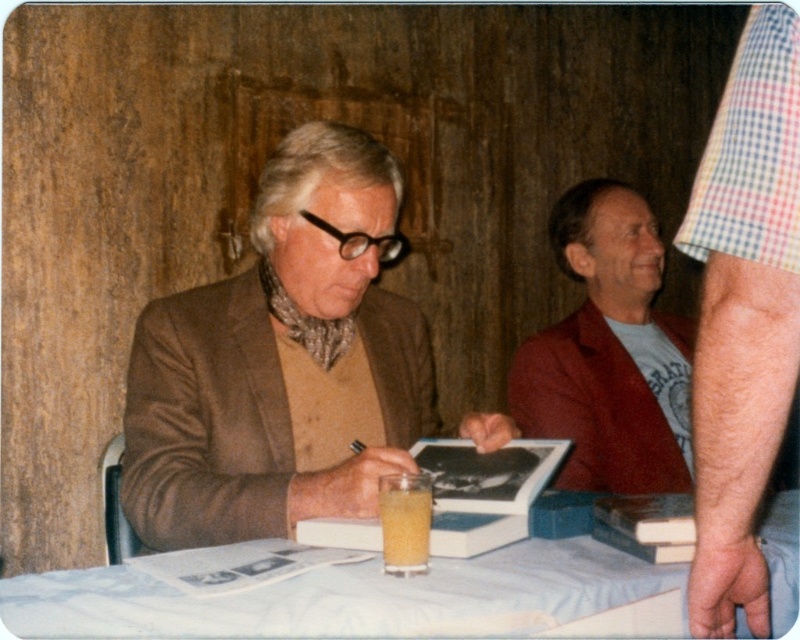
You are standing at the center of the room and want to place a small object on the table. Which direction should you move to reach the checkered fabric arm at right?

The checkered fabric arm at right is located at point (744, 316), so you should move to the right side of the table to reach it.

You are organizing the items on the table. If you want to move the translucent yellow liquid at table center to the left side of the white cloth at lower center, which direction should you move it?

The white cloth at lower center is currently on the right side of the translucent yellow liquid at table center. To move the liquid to the left side of the cloth, you should move it to the right.